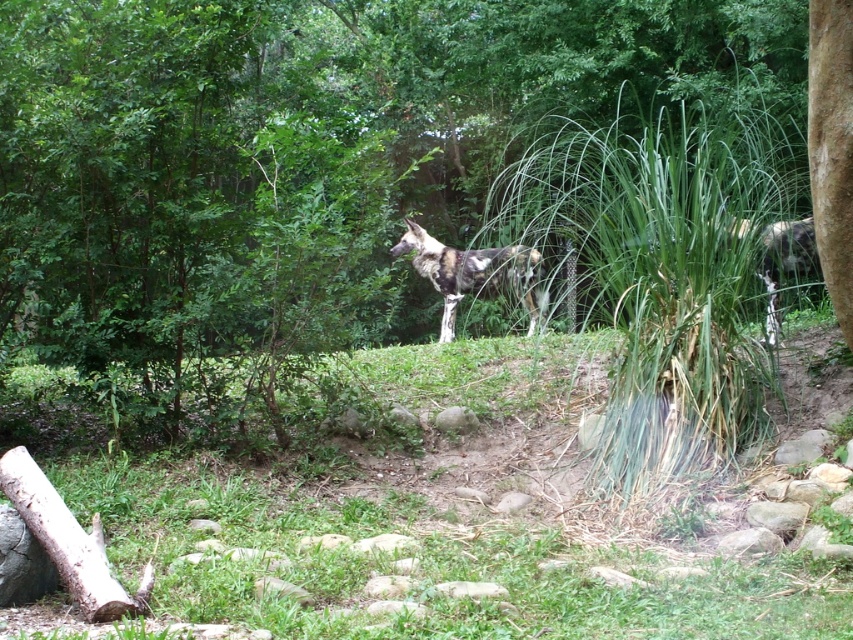
You are a zookeeper planning to place a new feeding station in the enclosure. The feeding station requires a flat area larger than the spotted fur wild dog at center. Based on the scene, is the green grass at center a suitable location for the feeding station?

The green grass at center is smaller than the spotted fur wild dog at center, so it is not large enough to accommodate the feeding station which requires a flat area larger than the dog.

You are a zookeeper planning to place a feeding tray for the spotted fur wild dog at center. The feeding tray requires a flat surface. Based on the scene, is the green grass at center a suitable location for placing the feeding tray?

The green grass at center is positioned under the spotted fur wild dog at center, so placing the feeding tray there may not be suitable since the wild dog is already occupying that spot.